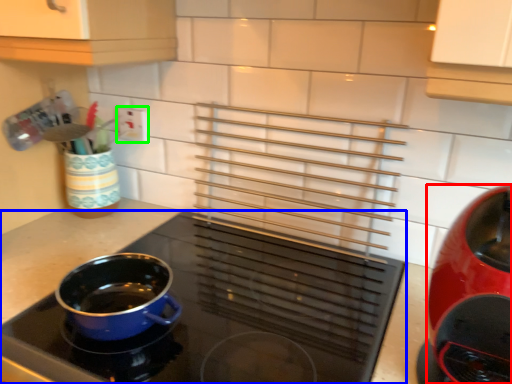
Question: Which is farther away from kitchen appliance (highlighted by a red box)? kitchen appliance (highlighted by a blue box) or electric outlet (highlighted by a green box)?

Choices:
 (A) kitchen appliance
 (B) electric outlet

Answer: (B)